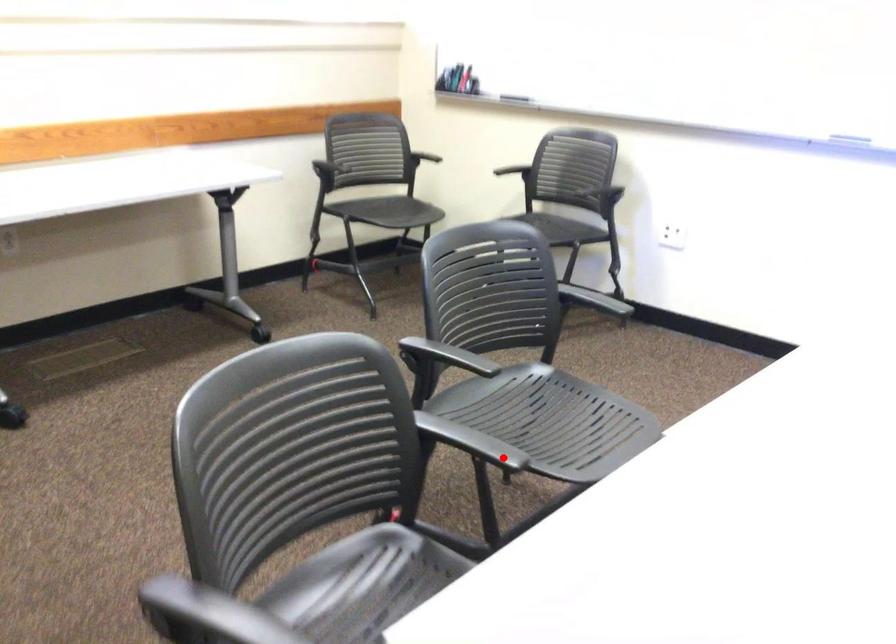
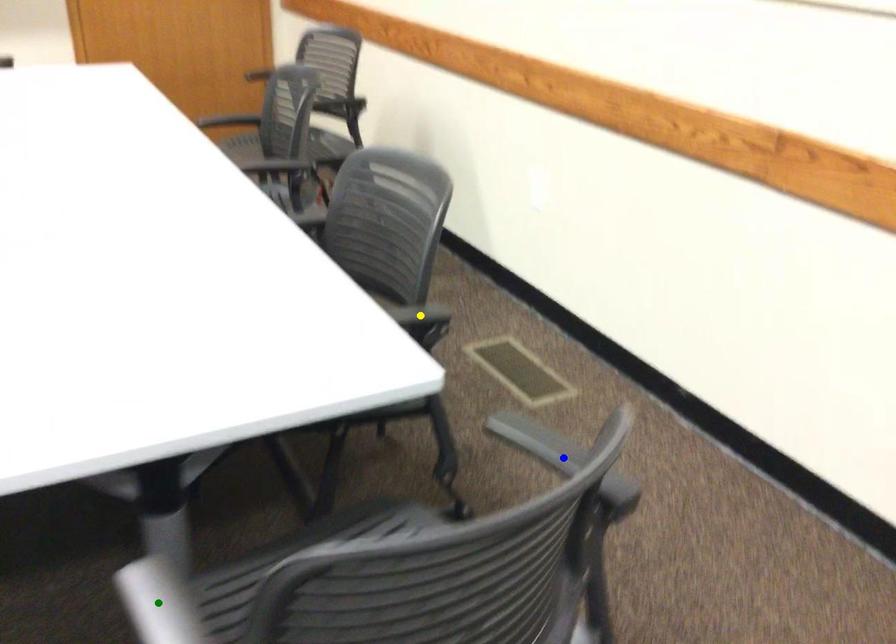
Question: I am providing you with two images of the same scene from different viewpoints. A red point is marked on the first image. You are given multiple points on the second image. Can you choose the point in image 2 that corresponds to the point in image 1?

Choices:
 (A) yellow point
 (B) green point
 (C) blue point

Answer: (B)